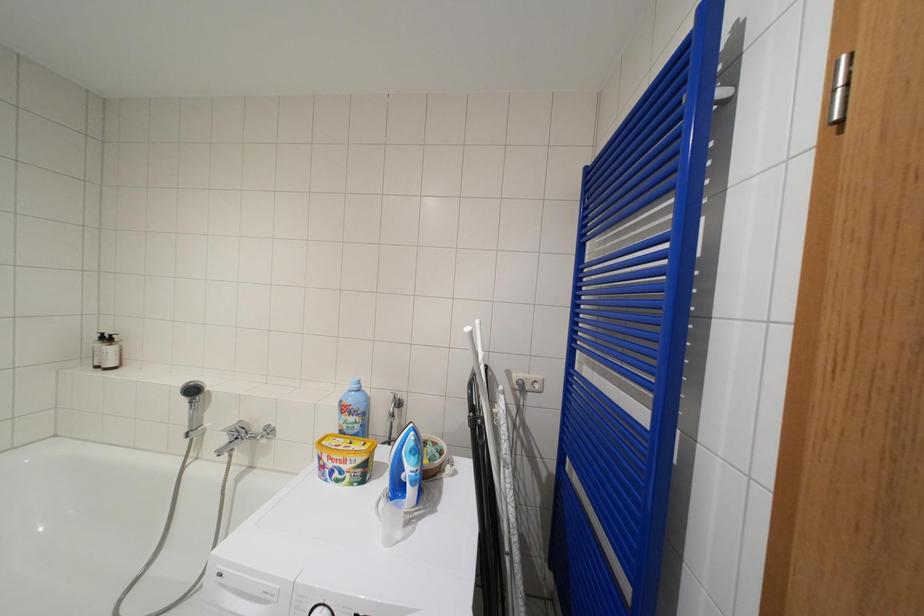
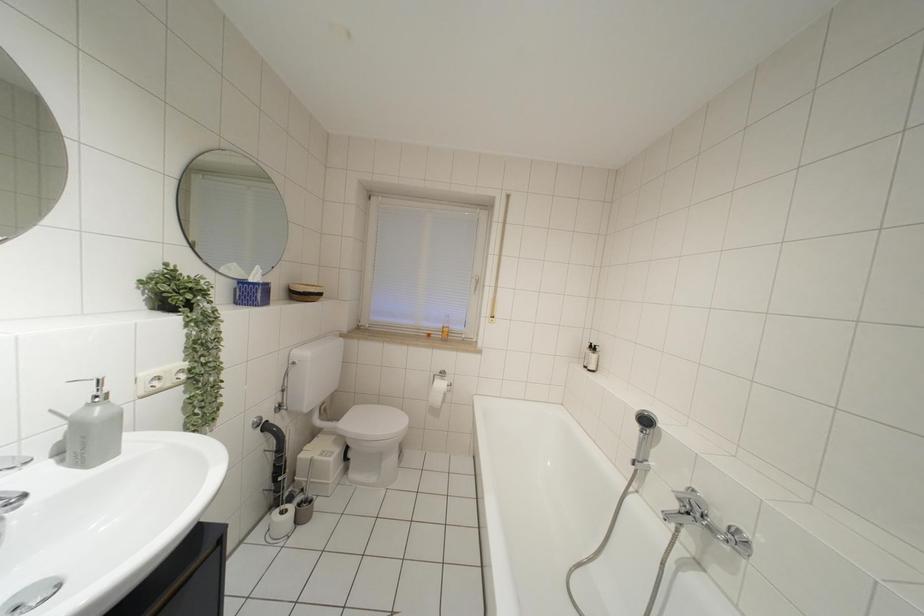
Question: The camera is either moving clockwise (left) or counter-clockwise (right) around the object. The first image is from the beginning of the video and the second image is from the end. Is the camera moving left or right when shooting the video?

Choices:
 (A) Left
 (B) Right

Answer: (B)